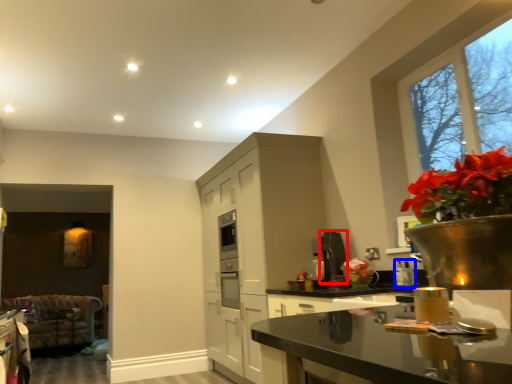
Question: Which point is further to the camera, appliance (highlighted by a red box) or appliance (highlighted by a blue box)?

Choices:
 (A) appliance
 (B) appliance

Answer: (A)